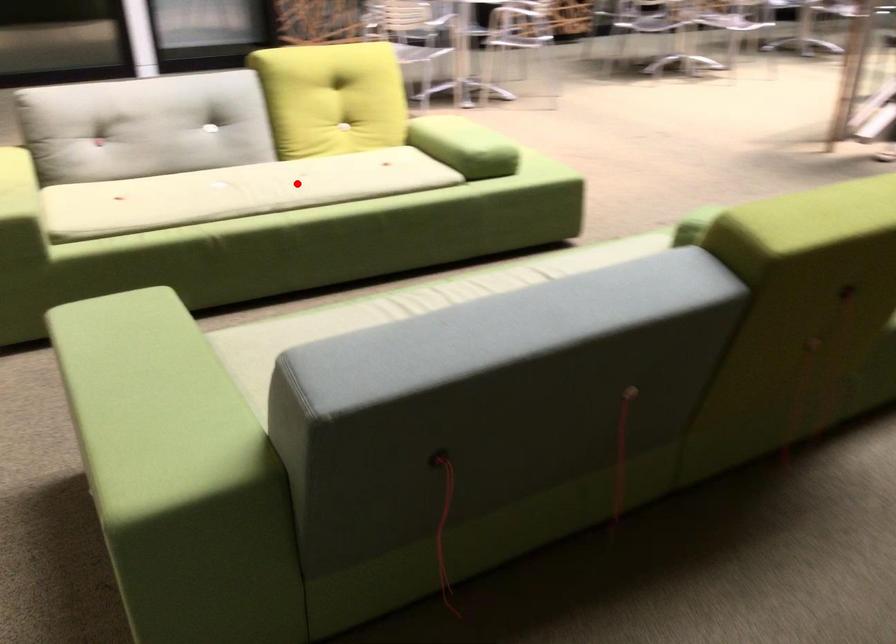
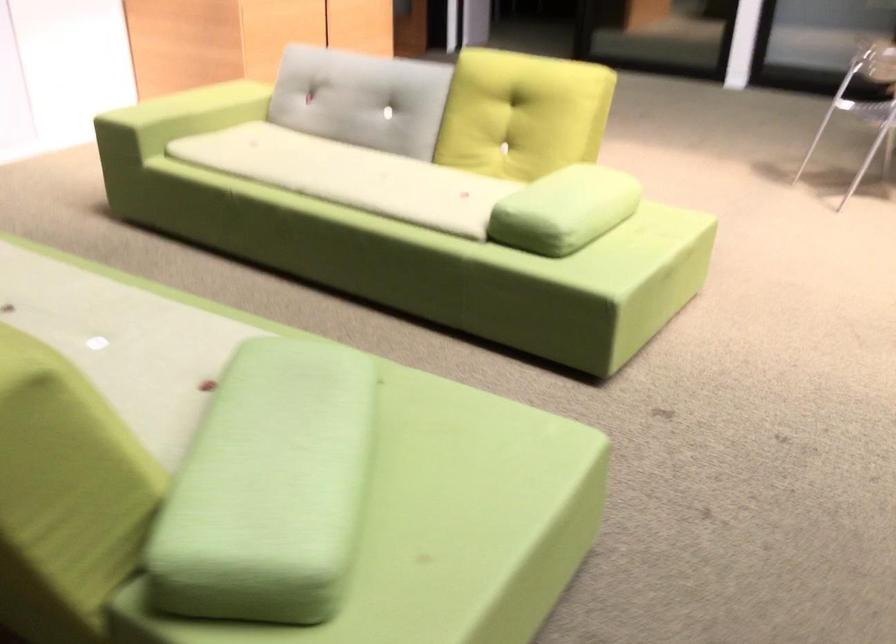
The point at the highlighted location is marked in the first image. Where is the corresponding point in the second image?

(349, 176)